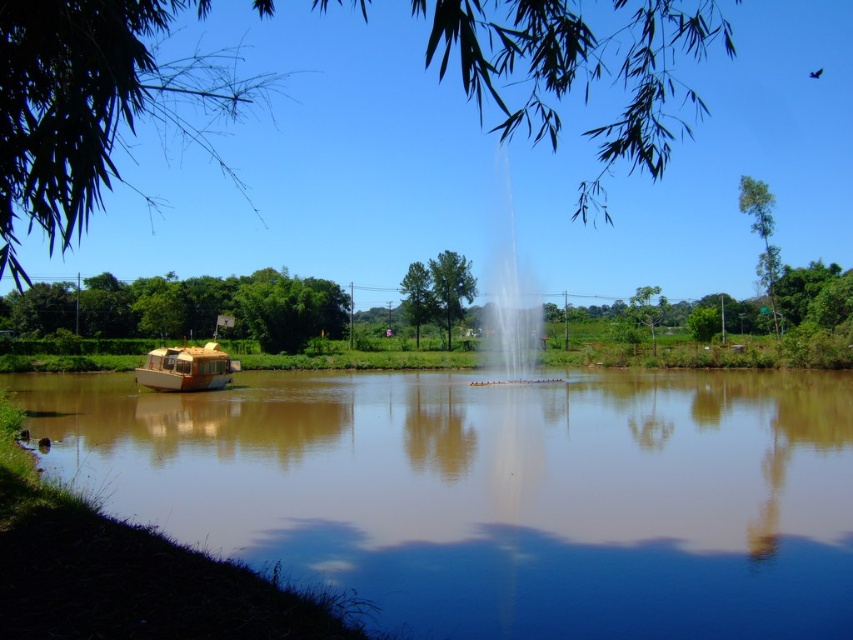
You are standing on the grassy bank and want to shade yourself from the sun using the objects in the scene. Which object, the green leafy tree at left or the wooden boat at left, would provide better shade based on their sizes?

The green leafy tree at left is taller than the wooden boat at left, so it would provide better shade as it is larger in size.